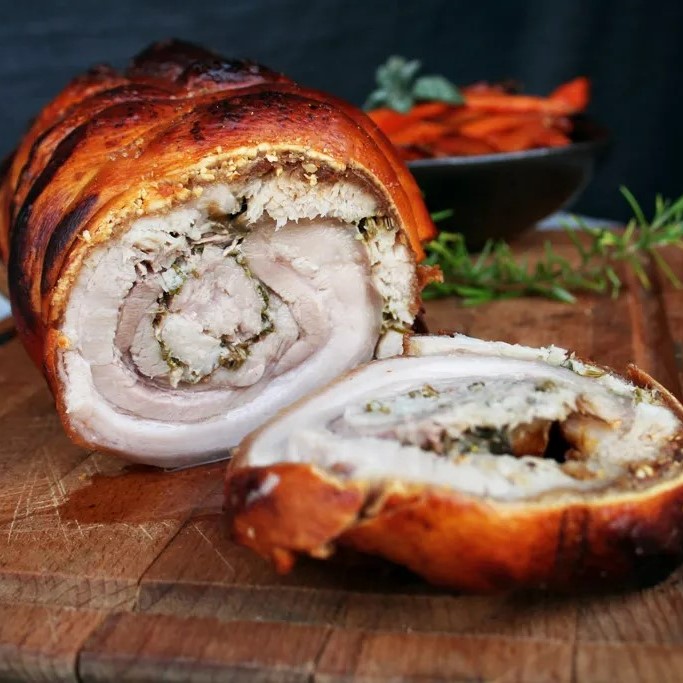
Locate an element on the screen. brown cutting board is located at coordinates (87, 550).